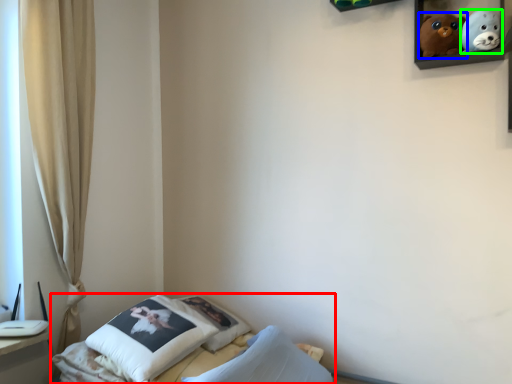
Question: Which object is the closest to the bed (highlighted by a red box)? Choose among these: toy (highlighted by a blue box) or toy (highlighted by a green box).

Choices:
 (A) toy
 (B) toy

Answer: (A)